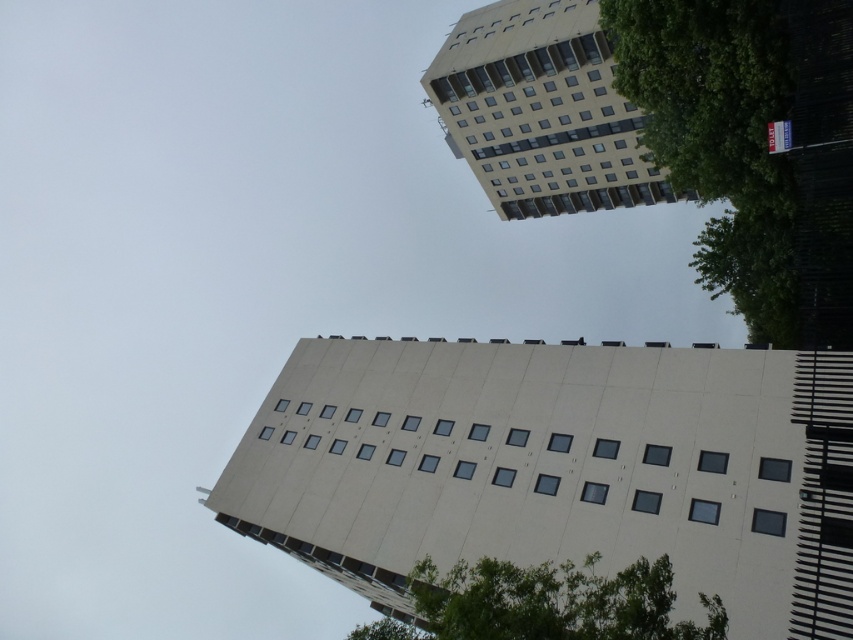
Can you confirm if white smooth building at center is bigger than beige concrete building at upper center?

Incorrect, white smooth building at center is not larger than beige concrete building at upper center.

Between point (670, 540) and point (521, 132), which one is positioned behind?

The point (521, 132) is more distant.

Where is `white smooth building at center`? white smooth building at center is located at coordinates (560, 467).

Describe the element at coordinates (543, 109) in the screenshot. I see `beige concrete building at upper center` at that location.

Who is positioned more to the left, beige concrete building at upper center or green leafy tree at lower right?

From the viewer's perspective, green leafy tree at lower right appears more on the left side.

This screenshot has width=853, height=640. In order to click on beige concrete building at upper center in this screenshot , I will do `click(543, 109)`.

What are the coordinates of `beige concrete building at upper center` in the screenshot? It's located at (543, 109).

Is green leafy tree at upper right further to camera compared to green leafy tree at lower right?

Yes.

Based on the photo, who is more forward, (712,193) or (590,620)?

Point (590,620) is in front.

The image size is (853, 640). Find the location of `green leafy tree at upper right`. green leafy tree at upper right is located at coordinates (753, 147).